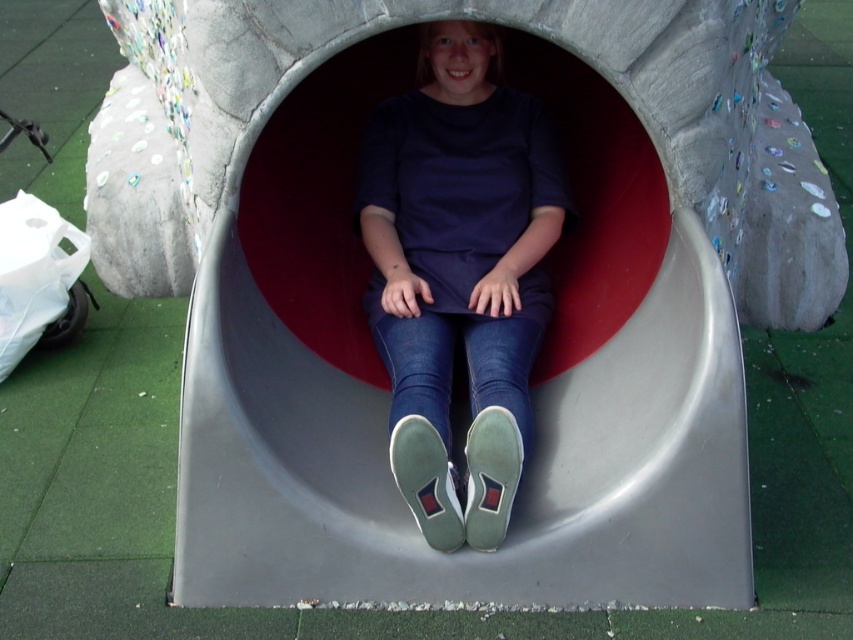
You are designing a safety inspection report for the playground. According to the image, which object, the smooth plastic slide at center or the matte blue jeans at center, requires more attention due to its size? Please explain your reasoning.

The smooth plastic slide at center requires more attention due to its larger size compared to the matte blue jeans at center, as larger structures may pose different safety considerations such as structural integrity and potential for impact injuries.

You are standing at the entrance of the circular tunnel and want to slide down the smooth plastic slide at center. Based on your position, is the slide to your left, right, or directly ahead?

The smooth plastic slide at center is located at point coordinates that place it directly ahead of your position at the tunnel entrance.